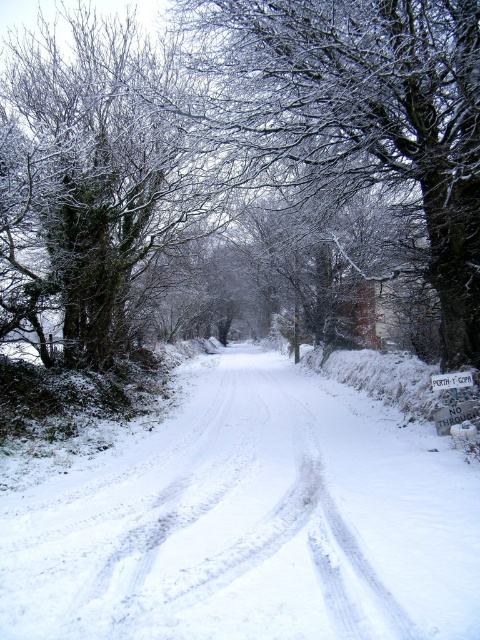
Question: Which of these objects is positioned closest to the white frosty tree at center?

Choices:
 (A) white plastic sign at center
 (B) white powdery snow at center

Answer: (A)

Question: Is white powdery snow at center above white frosty tree at center?

Choices:
 (A) yes
 (B) no

Answer: (B)

Question: Based on their relative distances, which object is farther from the white powdery snow at center?

Choices:
 (A) white frosty tree at center
 (B) white plastic sign at center

Answer: (A)

Question: Where is white powdery snow at center located in relation to white frosty tree at center in the image?

Choices:
 (A) above
 (B) below

Answer: (B)

Question: Which is farther from the white powdery snow at center?

Choices:
 (A) white plastic sign at center
 (B) white frosty tree at center

Answer: (B)

Question: Does white powdery snow at center lie behind white plastic sign at center?

Choices:
 (A) no
 (B) yes

Answer: (A)